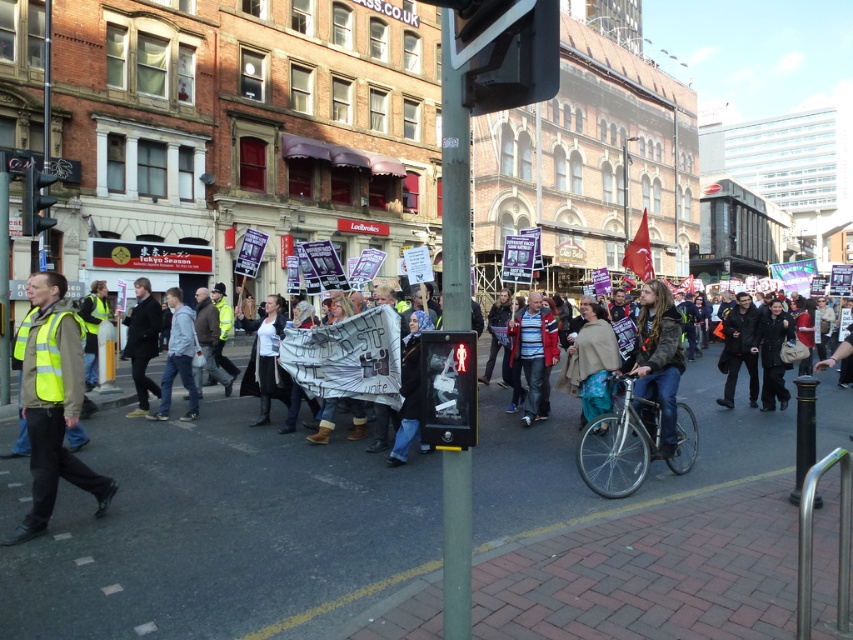
You are a photographer trying to capture a closeup of the striped cotton shirt at center and the black leather jacket at center. Which one would you need to move closer to the camera to get a clear shot?

The striped cotton shirt at center is larger in size than the black leather jacket at center, so you would need to move the black leather jacket at center closer to the camera to get a clear shot.